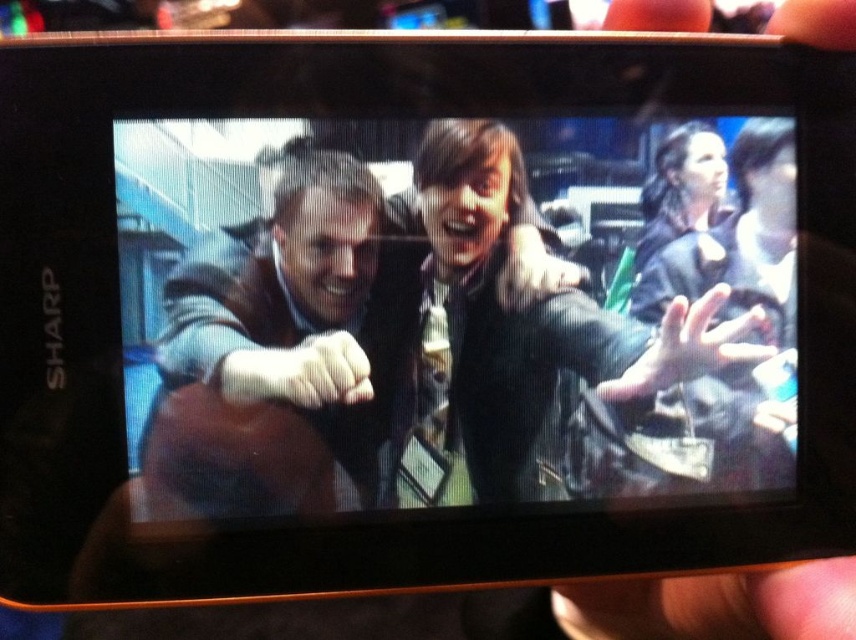
Can you confirm if flesh-toned skin at lower right is bigger than smooth black hair at upper right?

Yes.

Is flesh-toned skin at lower right closer to camera compared to smooth black hair at upper right?

Yes, it is.

What are the coordinates of `flesh-toned skin at lower right` in the screenshot? It's located at (715, 605).

Locate an element on the screen. This screenshot has height=640, width=856. flesh-toned skin at lower right is located at coordinates (715, 605).

Is point (811, 628) less distant than point (691, 323)?

Yes, it is in front of point (691, 323).

Does flesh-toned skin at lower right appear on the left side of smooth leather hand at center right?

Indeed, flesh-toned skin at lower right is positioned on the left side of smooth leather hand at center right.

Is point (658, 628) positioned behind point (724, 330)?

Yes, it is behind point (724, 330).

Locate an element on the screen. The height and width of the screenshot is (640, 856). flesh-toned skin at lower right is located at coordinates (715, 605).

Which of these two, smooth leather hand at center right or smooth black hair at upper right, stands taller?

smooth black hair at upper right

Is smooth leather hand at center right taller than smooth black hair at upper right?

Incorrect, smooth leather hand at center right's height is not larger of smooth black hair at upper right's.

The height and width of the screenshot is (640, 856). I want to click on smooth leather hand at center right, so click(688, 348).